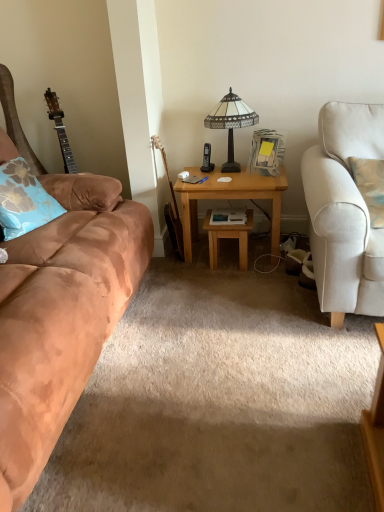
Where is `vacant space to the right of wooden acoustic guitar at center`? vacant space to the right of wooden acoustic guitar at center is located at coordinates (199, 254).